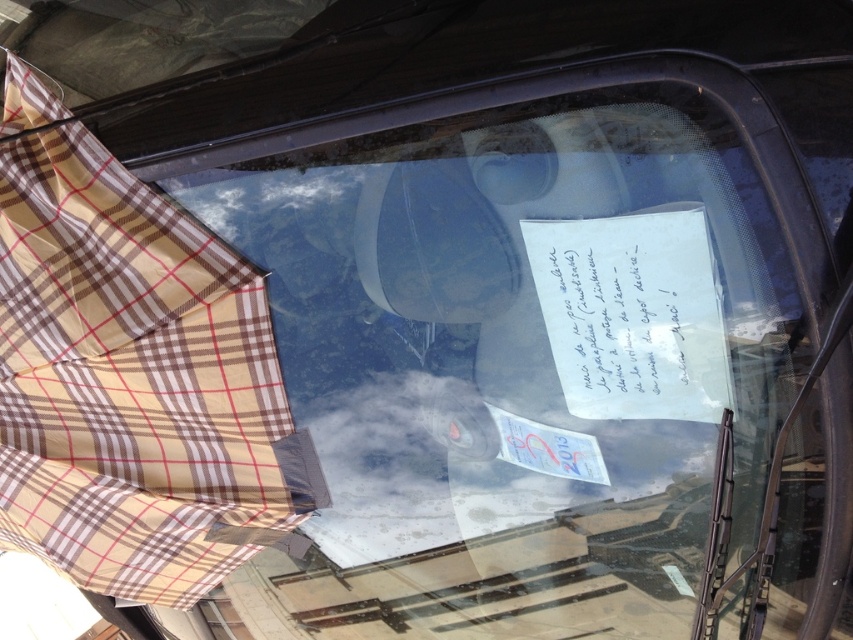
Is point (119, 292) behind point (648, 304)?

Yes, it is behind point (648, 304).

Is point (132, 244) positioned before point (607, 330)?

No, it is not.

Is point (210, 364) positioned before point (654, 348)?

No.

The height and width of the screenshot is (640, 853). What are the coordinates of `brown plaid umbrella at left` in the screenshot? It's located at (134, 384).